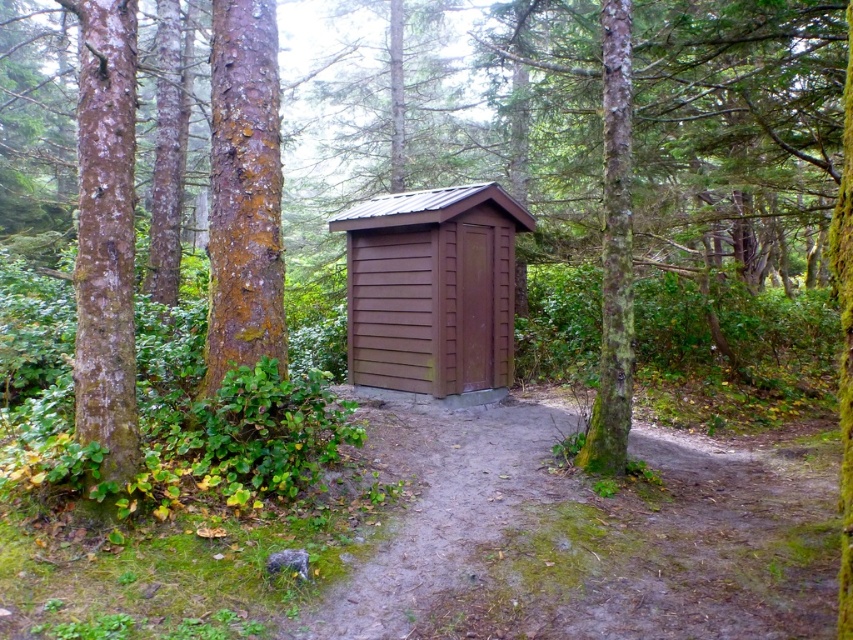
Measure the distance between point (239, 138) and camera.

Point (239, 138) is 16.30 feet away from camera.

Is smooth brown bark at center to the right of green mossy tree trunk at center from the viewer's perspective?

No, smooth brown bark at center is not to the right of green mossy tree trunk at center.

Find the location of `smooth brown bark at center`. smooth brown bark at center is located at coordinates (244, 192).

Who is more forward, (432, 608) or (614, 4)?

Point (432, 608)

Is brown dirt path at center shorter than green mossy tree trunk at center?

Indeed, brown dirt path at center has a lesser height compared to green mossy tree trunk at center.

You are a GUI agent. You are given a task and a screenshot of the screen. Output one action in this format:
    pyautogui.click(x=<x>, y=<y>)
    Task: Click on the brown dirt path at center
    The height and width of the screenshot is (640, 853).
    Given the screenshot: What is the action you would take?
    pyautogui.click(x=585, y=538)

Locate an element on the screen. The image size is (853, 640). brown dirt path at center is located at coordinates (585, 538).

Is brown wood shed at center positioned before smooth brown bark at center?

No, brown wood shed at center is behind smooth brown bark at center.

Consider the image. Which of these two, brown wood shed at center or smooth brown bark at center, stands shorter?

With less height is brown wood shed at center.

Between point (376, 355) and point (210, 115), which one is positioned behind?

Point (210, 115)

Find the location of a particular element. Image resolution: width=853 pixels, height=640 pixels. brown wood shed at center is located at coordinates (431, 289).